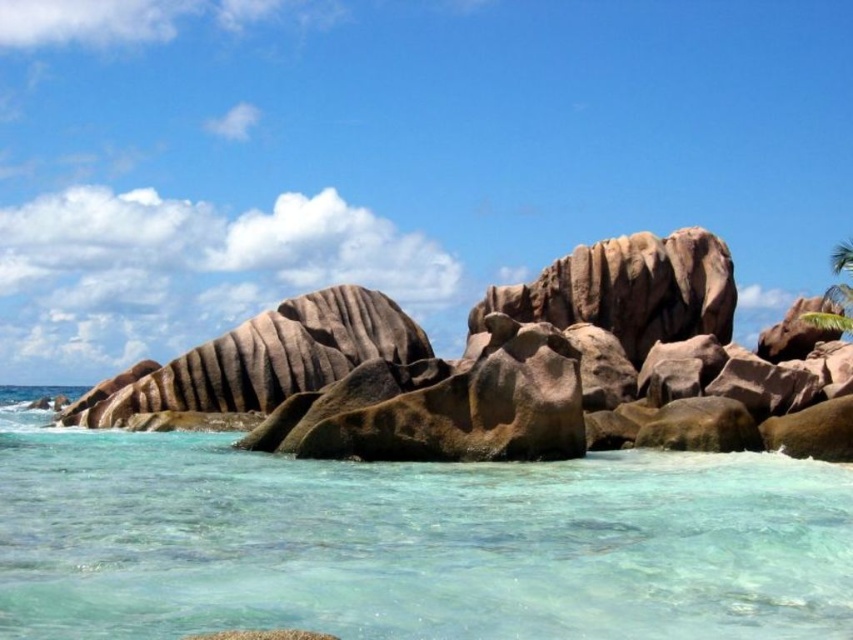
Question: Is the position of clear glassy water at lower center more distant than that of brown textured rock at center?

Choices:
 (A) yes
 (B) no

Answer: (B)

Question: From the image, what is the correct spatial relationship of clear glassy water at lower center in relation to brown textured rock at center?

Choices:
 (A) above
 (B) below

Answer: (B)

Question: Can you confirm if clear glassy water at lower center is wider than brown textured rock at center?

Choices:
 (A) yes
 (B) no

Answer: (B)

Question: Which is nearer to the clear glassy water at lower center?

Choices:
 (A) green leafy palm tree at upper right
 (B) brown textured rock at center

Answer: (B)

Question: Which point appears closest to the camera in this image?

Choices:
 (A) (466, 612)
 (B) (834, 296)
 (C) (625, 396)

Answer: (A)

Question: Which of the following is the farthest from the observer?

Choices:
 (A) green leafy palm tree at upper right
 (B) brown textured rock at center
 (C) clear glassy water at lower center

Answer: (A)